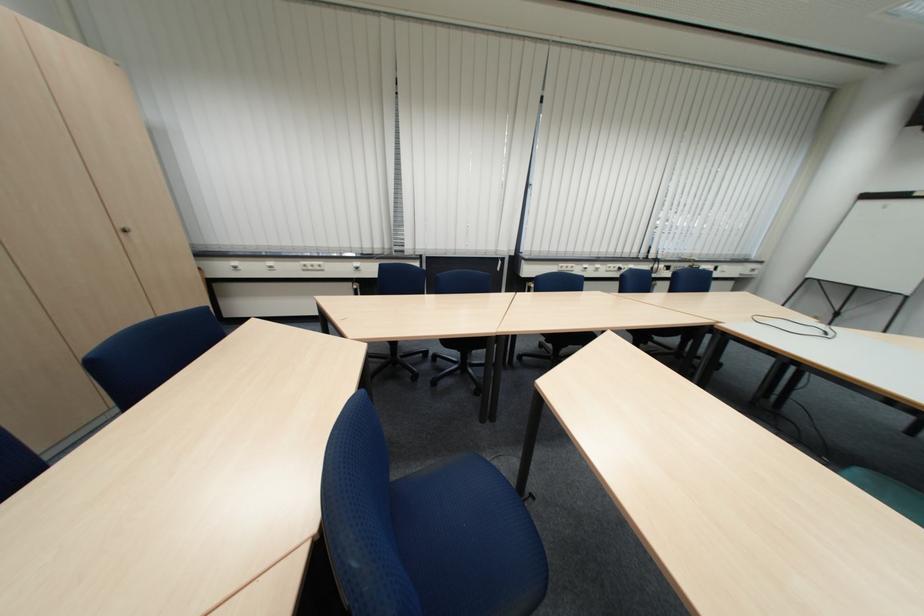
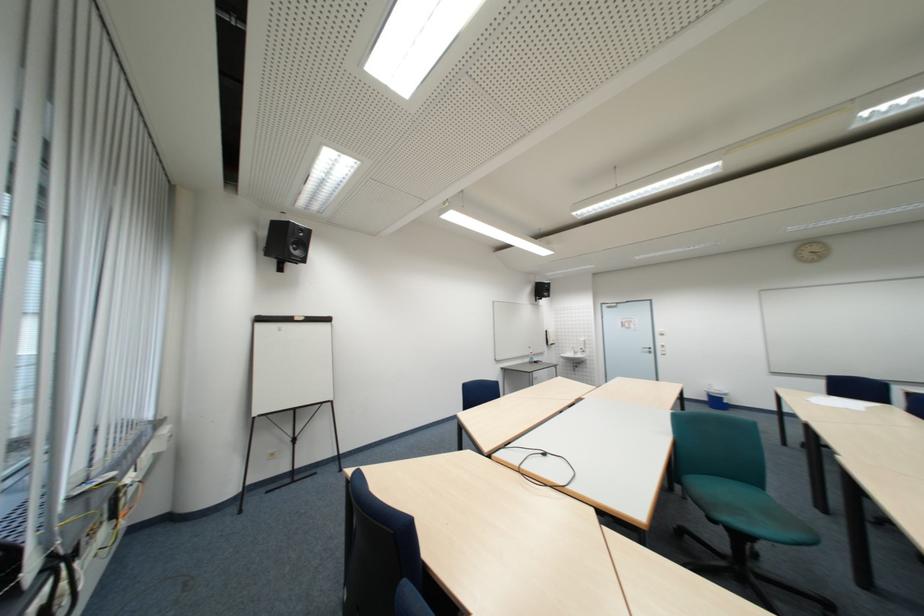
Find the pixel in the second image that matches the point at 880,198 in the first image.

(273, 321)